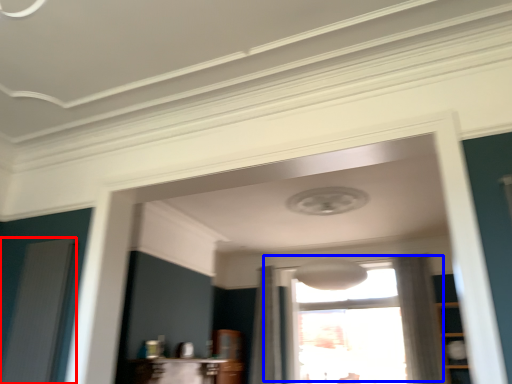
Question: Which of the following is the closest to the observer, screen door (highlighted by a red box) or window (highlighted by a blue box)?

Choices:
 (A) screen door
 (B) window

Answer: (A)